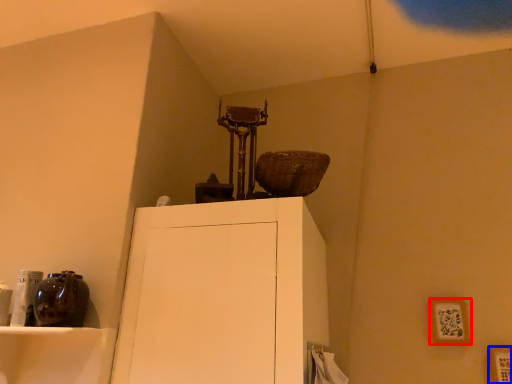
Question: Which point is further to the camera, picture frame (highlighted by a red box) or picture frame (highlighted by a blue box)?

Choices:
 (A) picture frame
 (B) picture frame

Answer: (A)